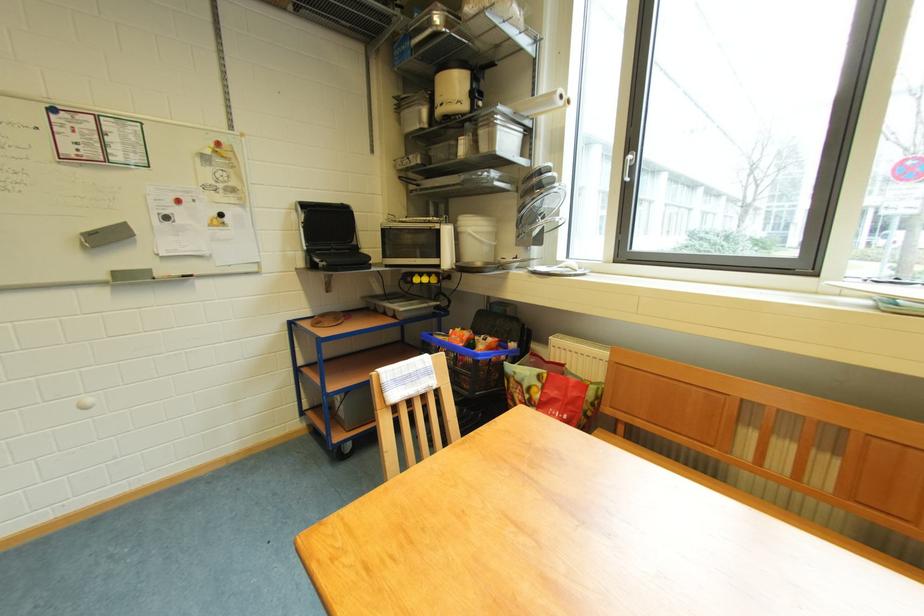
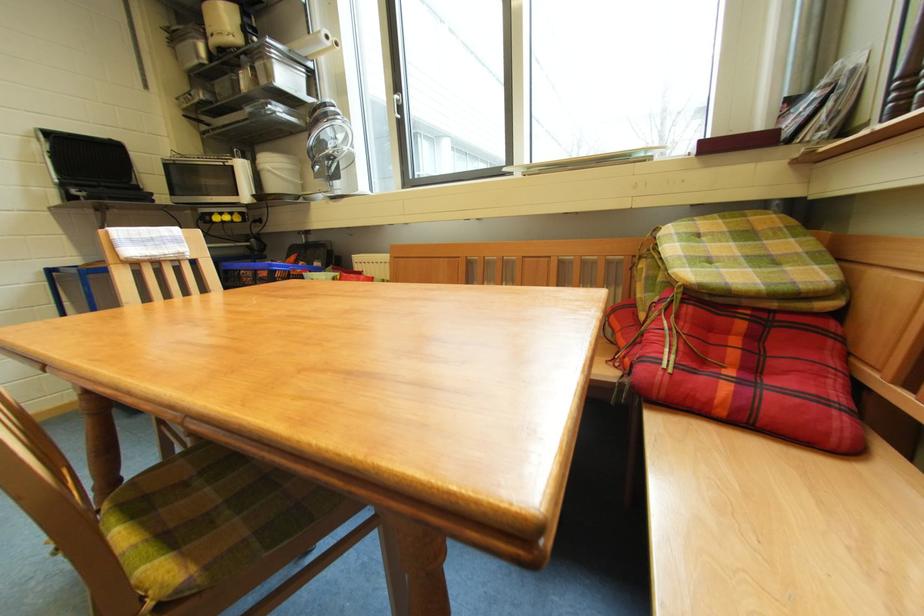
The point at (634,161) is marked in the first image. Where is the corresponding point in the second image?

(402, 102)